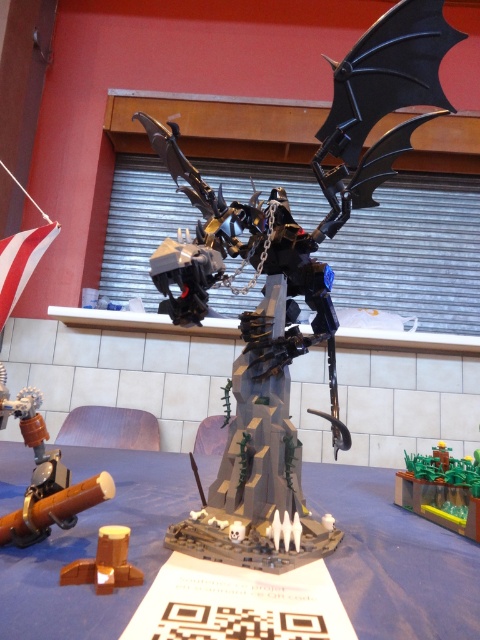
Question: Estimate the real-world distances between objects in this image. Which object is closer to the blue fabric table at center?

Choices:
 (A) brushed metal pipe at lower left
 (B) black matte dragon at center

Answer: (A)

Question: Is blue fabric table at center below brushed metal pipe at lower left?

Choices:
 (A) yes
 (B) no

Answer: (A)

Question: Does blue fabric table at center appear on the left side of green plastic plant at center?

Choices:
 (A) no
 (B) yes

Answer: (B)

Question: Which object is closer to the camera taking this photo?

Choices:
 (A) black matte dragon at center
 (B) brushed metal pipe at lower left
 (C) blue fabric table at center

Answer: (C)

Question: Does black matte dragon at center appear under green plastic plant at center?

Choices:
 (A) yes
 (B) no

Answer: (B)

Question: Which object appears farthest from the camera in this image?

Choices:
 (A) black matte dragon at center
 (B) brushed metal pipe at lower left
 (C) blue fabric table at center
 (D) green plastic plant at center

Answer: (D)